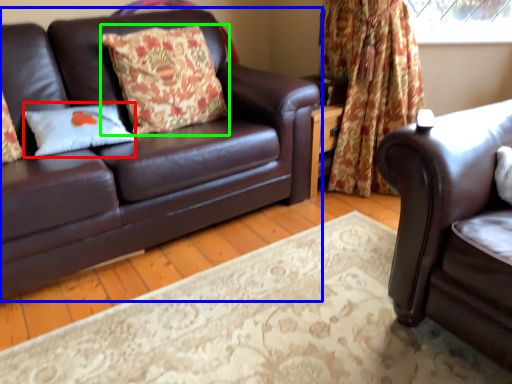
Question: Which object is positioned farthest from pillow (highlighted by a red box)? Select from studio couch (highlighted by a blue box) and pillow (highlighted by a green box).

Choices:
 (A) studio couch
 (B) pillow

Answer: (B)